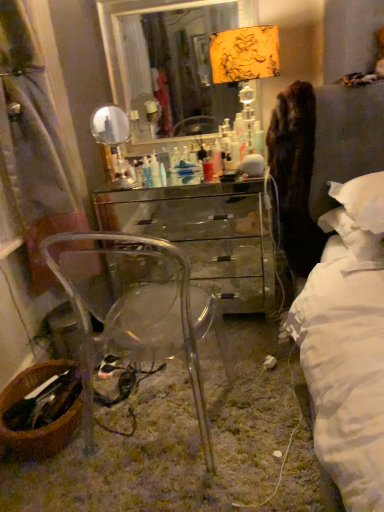
Measure the distance between white soft pillow at right, positioned as the first pillow in top-to-bottom order, and camera.

A distance of 1.37 meters exists between white soft pillow at right, positioned as the first pillow in top-to-bottom order, and camera.

Image resolution: width=384 pixels, height=512 pixels. Describe the element at coordinates (362, 201) in the screenshot. I see `white soft pillow at right, positioned as the first pillow in top-to-bottom order` at that location.

At what (x,y) coordinates should I click in order to perform the action: click on metallic silver mirror at upper center. Please return your answer as a coordinate pair (x, y). The height and width of the screenshot is (512, 384). Looking at the image, I should click on (172, 54).

Measure the distance between translucent plastic container at center and camera.

The depth of translucent plastic container at center is 2.09 meters.

Describe the element at coordinates (206, 234) in the screenshot. I see `glossy mirrored chest of drawers at center` at that location.

Find the location of a particular element. white soft pillow at right, the second pillow when ordered from top to bottom is located at coordinates (355, 238).

Identify the location of white soft pillow at right, positioned as the first pillow in top-to-bottom order. The image size is (384, 512). (362, 201).

From the image's perspective, which one is positioned lower, translucent plastic container at center or metallic silver mirror at upper center?

From the image's view, translucent plastic container at center is below.

Is translucent plastic container at center not close to metallic silver mirror at upper center?

No, translucent plastic container at center is in close proximity to metallic silver mirror at upper center.

Can metallic silver mirror at upper center be found inside translucent plastic container at center?

No, metallic silver mirror at upper center is not surrounded by translucent plastic container at center.

Are glossy mirrored chest of drawers at center and transparent acrylic chair at center located far from each other?

glossy mirrored chest of drawers at center is actually quite close to transparent acrylic chair at center.

Is point (139, 208) positioned behind point (50, 261)?

Yes, it is.

Can you confirm if glossy mirrored chest of drawers at center is taller than transparent acrylic chair at center?

Incorrect, the height of glossy mirrored chest of drawers at center is not larger of that of transparent acrylic chair at center.

From a real-world perspective, is glossy mirrored chest of drawers at center physically above transparent acrylic chair at center?

No, from a real-world perspective, glossy mirrored chest of drawers at center is not over transparent acrylic chair at center

From the image's perspective, is white soft pillow at right, positioned as the first pillow in top-to-bottom order, below translucent plastic container at center?

Yes, from the image's perspective, white soft pillow at right, positioned as the first pillow in top-to-bottom order, is below translucent plastic container at center.

Considering the relative sizes of white soft pillow at right, positioned as the first pillow in top-to-bottom order, and translucent plastic container at center in the image provided, is white soft pillow at right, positioned as the first pillow in top-to-bottom order, thinner than translucent plastic container at center?

No, white soft pillow at right, positioned as the first pillow in top-to-bottom order, is not thinner than translucent plastic container at center.

Is white soft pillow at right, the second pillow in the bottom-to-top sequence, to the left or to the right of translucent plastic container at center in the image?

white soft pillow at right, the second pillow in the bottom-to-top sequence, is positioned on translucent plastic container at center's right side.

Could you tell me if white soft pillow at right, the second pillow in the bottom-to-top sequence, is turned towards translucent plastic container at center?

No, white soft pillow at right, the second pillow in the bottom-to-top sequence, is not facing towards translucent plastic container at center.

Which is behind, transparent acrylic chair at center or floral fabric lampshade at upper center?

floral fabric lampshade at upper center.

From a real-world perspective, between transparent acrylic chair at center and floral fabric lampshade at upper center, who is vertically higher?

From a 3D spatial view, floral fabric lampshade at upper center is above.

How different are the orientations of transparent acrylic chair at center and floral fabric lampshade at upper center in degrees?

transparent acrylic chair at center and floral fabric lampshade at upper center are facing 174 degrees away from each other.

Could you tell me if floral fabric lampshade at upper center is turned towards white soft pillow at right, the second pillow when ordered from top to bottom?

No.

From the image's perspective, is floral fabric lampshade at upper center beneath white soft pillow at right, the second pillow when ordered from top to bottom?

No, from the image's perspective, floral fabric lampshade at upper center is not beneath white soft pillow at right, the second pillow when ordered from top to bottom.

Which object is more forward, floral fabric lampshade at upper center or white soft pillow at right, the second pillow when ordered from top to bottom?

white soft pillow at right, the second pillow when ordered from top to bottom, is closer to the camera.

Where is `table lamp above the white soft pillow at right, the second pillow when ordered from top to bottom (from a real-world perspective)`? table lamp above the white soft pillow at right, the second pillow when ordered from top to bottom (from a real-world perspective) is located at coordinates pos(245,54).

Is transparent acrylic chair at center to the left or to the right of glossy mirrored chest of drawers at center in the image?

Clearly, transparent acrylic chair at center is on the left of glossy mirrored chest of drawers at center in the image.

Is transparent acrylic chair at center positioned behind glossy mirrored chest of drawers at center?

No, transparent acrylic chair at center is closer to the camera.

The height and width of the screenshot is (512, 384). What are the coordinates of `chair on the left of the glossy mirrored chest of drawers at center` in the screenshot? It's located at (135, 309).

Is point (179, 27) positioned before point (381, 232)?

No, (179, 27) is further to viewer.

From the image's perspective, between metallic silver mirror at upper center and white soft pillow at right, the second pillow when ordered from top to bottom, which one is located above?

From the image's view, metallic silver mirror at upper center is above.

Is metallic silver mirror at upper center taller or shorter than white soft pillow at right, the second pillow when ordered from top to bottom?

Clearly, metallic silver mirror at upper center is taller compared to white soft pillow at right, the second pillow when ordered from top to bottom.

Is metallic silver mirror at upper center inside the boundaries of white soft pillow at right, acting as the 1th pillow starting from the bottom, or outside?

metallic silver mirror at upper center is outside white soft pillow at right, acting as the 1th pillow starting from the bottom.

Identify the location of toiletry that appears behind the metallic silver mirror at upper center. [155, 170].

Locate an element on the screen. This screenshot has width=384, height=512. chest of drawers that appears on the right of transparent acrylic chair at center is located at coordinates (206, 234).

Considering their positions, is metallic silver mirror at upper center positioned closer to glossy mirrored chest of drawers at center than floral fabric lampshade at upper center?

metallic silver mirror at upper center.

When comparing their distances from white soft pillow at right, positioned as the first pillow in top-to-bottom order, does white soft pillow at right, acting as the 1th pillow starting from the bottom, or metallic silver mirror at upper center seem further?

metallic silver mirror at upper center lies further to white soft pillow at right, positioned as the first pillow in top-to-bottom order, than the other object.

From the image, which object appears to be nearer to white soft pillow at right, the second pillow in the bottom-to-top sequence, translucent plastic container at center or white soft pillow at right, acting as the 1th pillow starting from the bottom?

Based on the image, white soft pillow at right, acting as the 1th pillow starting from the bottom, appears to be nearer to white soft pillow at right, the second pillow in the bottom-to-top sequence.

When comparing their distances from glossy mirrored chest of drawers at center, does white soft pillow at right, positioned as the first pillow in top-to-bottom order, or transparent acrylic chair at center seem closer?

Among the two, transparent acrylic chair at center is located nearer to glossy mirrored chest of drawers at center.

Based on the photo, from the image, which object appears to be nearer to glossy mirrored chest of drawers at center, transparent acrylic chair at center or white soft pillow at right, the second pillow in the bottom-to-top sequence?

transparent acrylic chair at center lies closer to glossy mirrored chest of drawers at center than the other object.

Based on their spatial positions, is transparent acrylic chair at center or white soft pillow at right, acting as the 1th pillow starting from the bottom, closer to white soft pillow at right, the second pillow in the bottom-to-top sequence?

Based on the image, white soft pillow at right, acting as the 1th pillow starting from the bottom, appears to be nearer to white soft pillow at right, the second pillow in the bottom-to-top sequence.

Considering their positions, is translucent plastic container at center positioned closer to glossy mirrored chest of drawers at center than white soft pillow at right, the second pillow in the bottom-to-top sequence?

translucent plastic container at center.

From the image, which object appears to be farther from translucent plastic container at center, metallic silver mirror at upper center or white soft pillow at right, the second pillow in the bottom-to-top sequence?

white soft pillow at right, the second pillow in the bottom-to-top sequence, is further to translucent plastic container at center.

Identify the location of toiletry that lies between floral fabric lampshade at upper center and glossy mirrored chest of drawers at center from top to bottom. (155, 170).

This screenshot has height=512, width=384. I want to click on pillow between glossy mirrored chest of drawers at center and white soft pillow at right, the second pillow in the bottom-to-top sequence, so click(355, 238).

This screenshot has width=384, height=512. I want to click on pillow positioned between white soft pillow at right, the second pillow in the bottom-to-top sequence, and translucent plastic container at center from near to far, so click(x=355, y=238).

Identify the location of the chest of drawers situated between transparent acrylic chair at center and white soft pillow at right, the second pillow when ordered from top to bottom, from left to right. (206, 234).